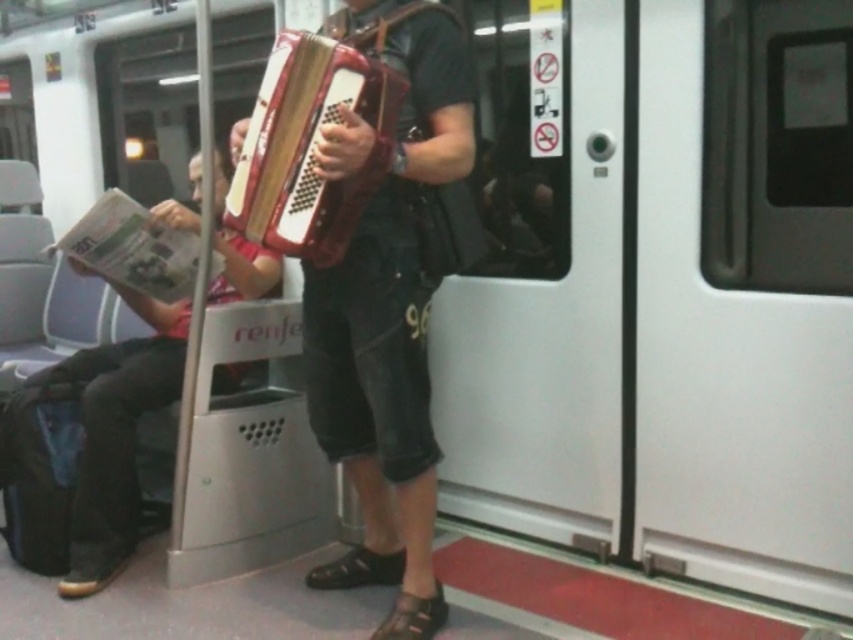
Based on the scene description, where is the wooden accordion at center located in the image?

The wooden accordion at center is located at point (395, 326) in the image.

You are a train passenger who wants to store your belongings in the overhead compartment. The overhead compartment has a width of 30 cm. You have a matte red accordion at center and a wooden textured accordion at center. Which one can fit inside the compartment?

The wooden textured accordion at center has a smaller width than the matte red accordion at center, so it can fit inside the 30 cm wide overhead compartment.